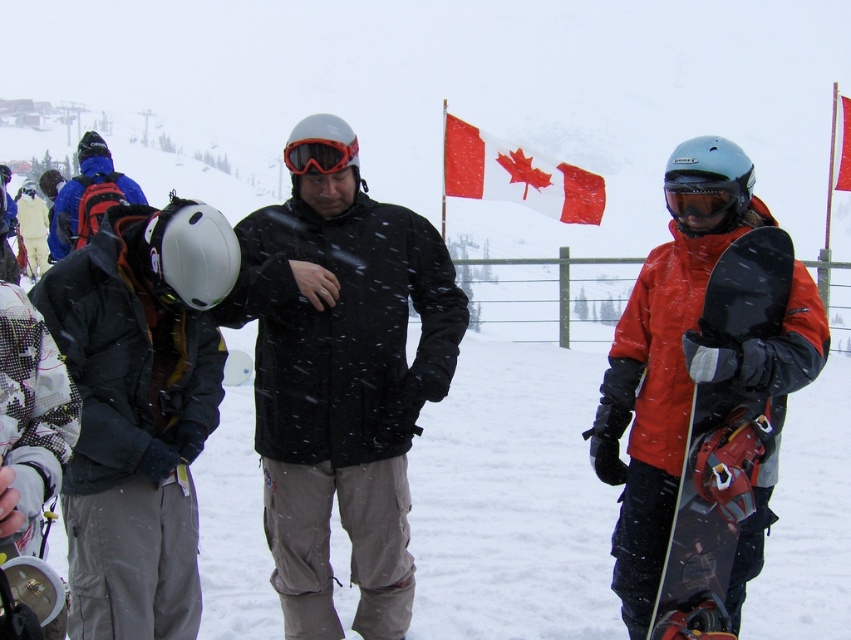
You are standing at the point with coordinates point (341, 387). What is the color of the jacket worn by the person located at this point?

The point (341, 387) corresponds to the matte black jacket at center, so the jacket is matte black.

You are standing at the point marked by the coordinate point at (90, 310). You want to walk to the ski lift located at the bottom of the mountain. Which direction should you head to reach the ski lift?

The ski lift is located at the bottom of the mountain, so you should head in the direction opposite to the mountain slope from the point at (90, 310).